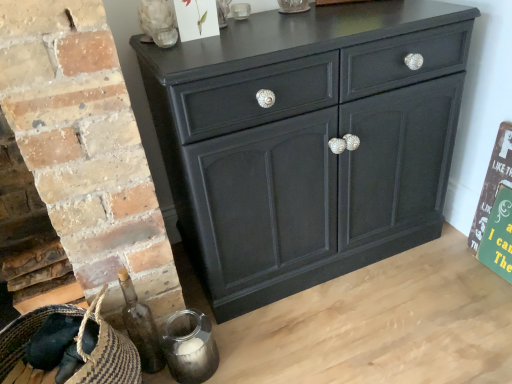
Where is `free spot in front of matte black cabinet at center`? free spot in front of matte black cabinet at center is located at coordinates (359, 329).